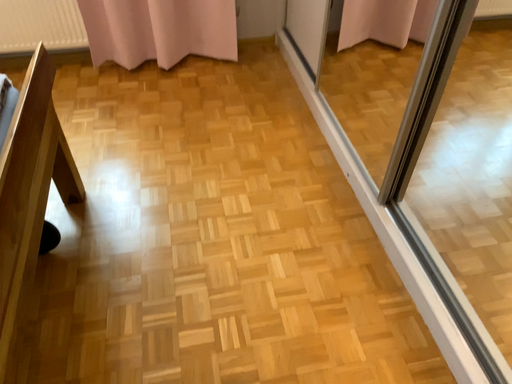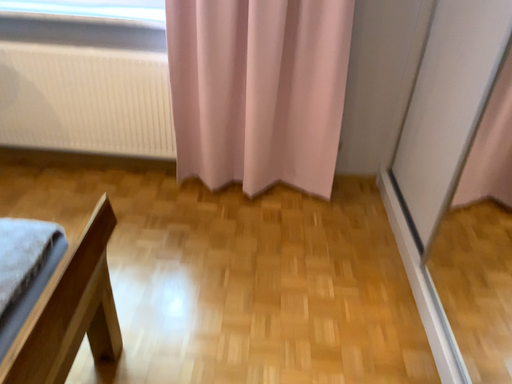
Question: How did the camera likely rotate when shooting the video?

Choices:
 (A) rotated downward
 (B) rotated upward

Answer: (B)